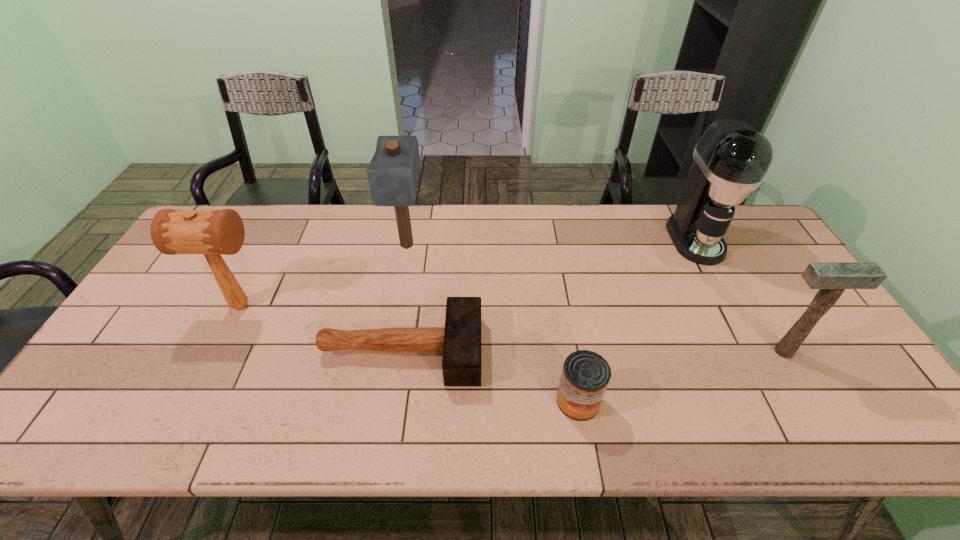
Where is `unoccupied position between the coffee maker and the rightmost mallet`? Image resolution: width=960 pixels, height=540 pixels. unoccupied position between the coffee maker and the rightmost mallet is located at coordinates (739, 295).

The width and height of the screenshot is (960, 540). I want to click on vacant area that lies between the leftmost object and the rightmost mallet, so click(x=512, y=328).

Where is `free space between the rightmost mallet and the coffee maker`? The image size is (960, 540). free space between the rightmost mallet and the coffee maker is located at coordinates (739, 295).

Identify the location of unoccupied area between the coffee maker and the farthest mallet. (551, 242).

Where is `free space between the leftmost mallet and the shortest object`? The width and height of the screenshot is (960, 540). free space between the leftmost mallet and the shortest object is located at coordinates (321, 328).

This screenshot has width=960, height=540. Find the location of `the second closest object to the farthest mallet`. the second closest object to the farthest mallet is located at coordinates (210, 232).

Identify the location of object that can be found as the third closest to the farthest mallet. This screenshot has width=960, height=540. (585, 376).

Locate an element on the screen. The width and height of the screenshot is (960, 540). the second closest mallet to the shortest object is located at coordinates (393, 172).

Select which mallet is the closest to the shortest mallet. Please provide its 2D coordinates. Your answer should be formatted as a tuple, i.e. [(x, y)], where the tuple contains the x and y coordinates of a point satisfying the conditions above.

[(210, 232)]

Identify the location of free space that satisfies the following two spatial constraints: 1. on the front side of the farthest mallet; 2. on the strike surface of the leftmost mallet. (396, 305).